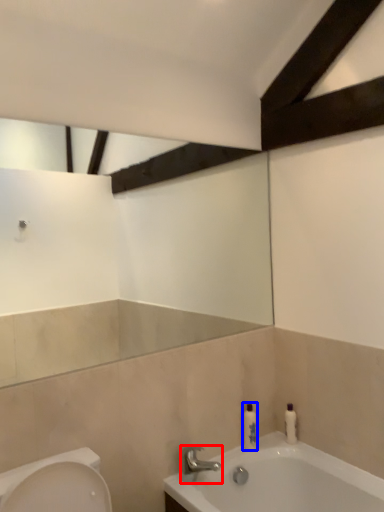
Question: Which point is closer to the camera, tap (highlighted by a red box) or toiletry (highlighted by a blue box)?

Choices:
 (A) tap
 (B) toiletry

Answer: (A)